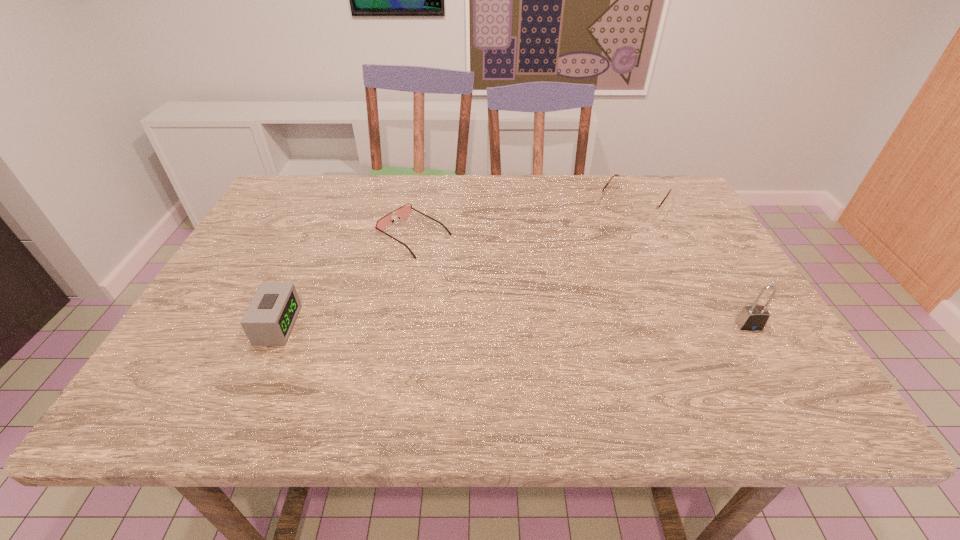
Find the location of a particular element. the third shortest object is located at coordinates [x=271, y=315].

You are a GUI agent. You are given a task and a screenshot of the screen. Output one action in this format:
    pyautogui.click(x=<x>, y=<y>)
    Task: Click on the leftmost object
    
    Given the screenshot: What is the action you would take?
    pyautogui.click(x=271, y=315)

Image resolution: width=960 pixels, height=540 pixels. I want to click on the tallest object, so click(x=754, y=317).

Find the location of a particular element. spectacles is located at coordinates (640, 210).

You are a GUI agent. You are given a task and a screenshot of the screen. Output one action in this format:
    pyautogui.click(x=<x>, y=<y>)
    Task: Click on the sunglasses
    
    Given the screenshot: What is the action you would take?
    pyautogui.click(x=403, y=211)

Locate an element on the screen. Image resolution: width=960 pixels, height=540 pixels. free space located on the front-facing side of the leftmost object is located at coordinates (323, 325).

This screenshot has width=960, height=540. Find the location of `vacant region located 0.070m on the shackle of the tallest object`. vacant region located 0.070m on the shackle of the tallest object is located at coordinates (769, 358).

Image resolution: width=960 pixels, height=540 pixels. In order to click on free region located on the front-facing side of the spectacles in this screenshot , I will do `click(599, 253)`.

Find the location of a particular element. The height and width of the screenshot is (540, 960). vacant space located 0.120m on the front-facing side of the spectacles is located at coordinates 607,242.

This screenshot has width=960, height=540. I want to click on vacant space located on the front-facing side of the spectacles, so click(x=613, y=233).